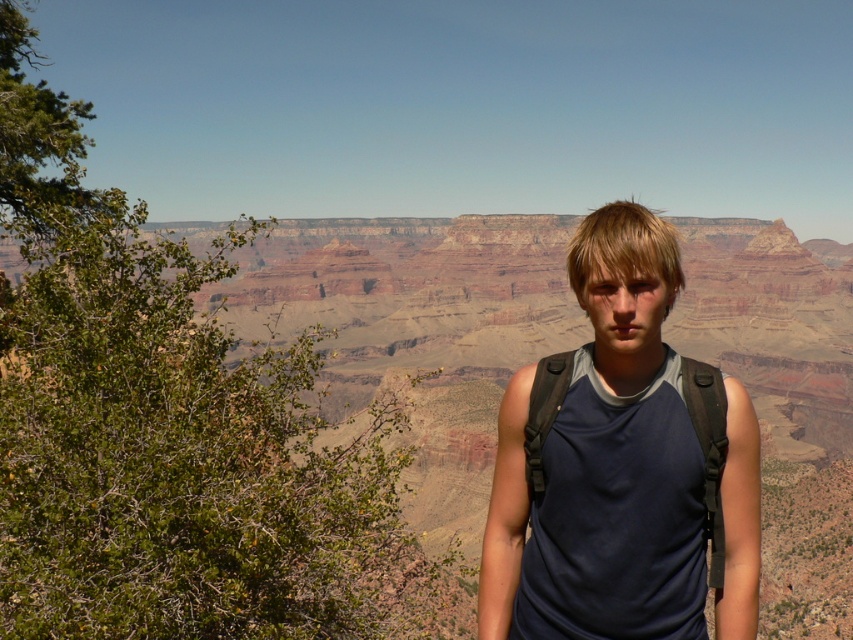
You are a photographer trying to capture the grandeur of the brown rock canyon at center and the dark blue fabric tank top at center in a single shot. Which object will appear larger in the photo?

The brown rock canyon at center will appear larger in the photo because it has a larger size compared to the dark blue fabric tank top at center.